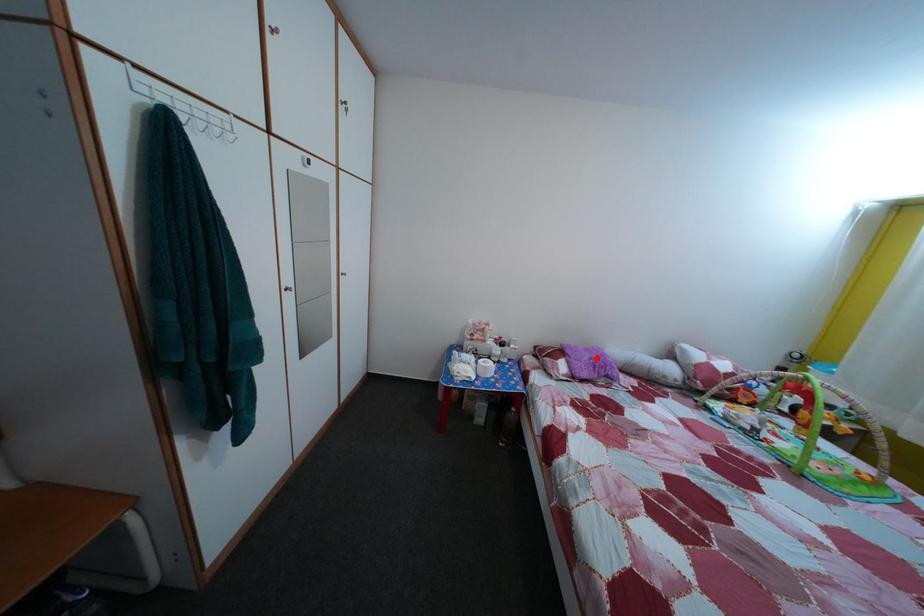
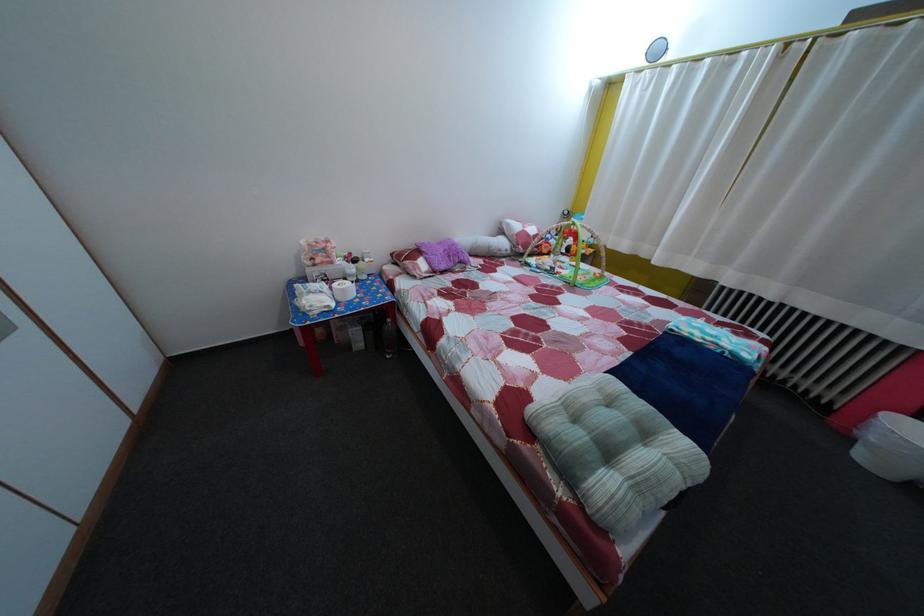
Find the pixel in the second image that matches the highlighted location in the first image.

(450, 252)